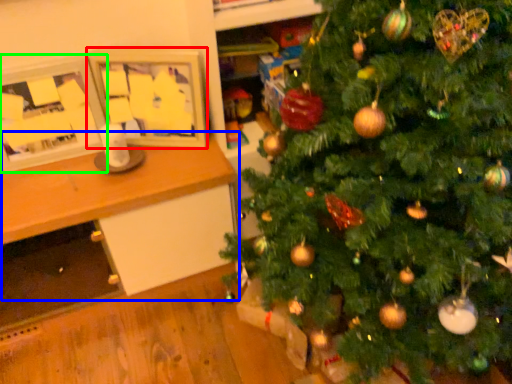
Question: Which object is the closest to the picture frame (highlighted by a red box)? Choose among these: table (highlighted by a blue box) or picture frame (highlighted by a green box).

Choices:
 (A) table
 (B) picture frame

Answer: (B)